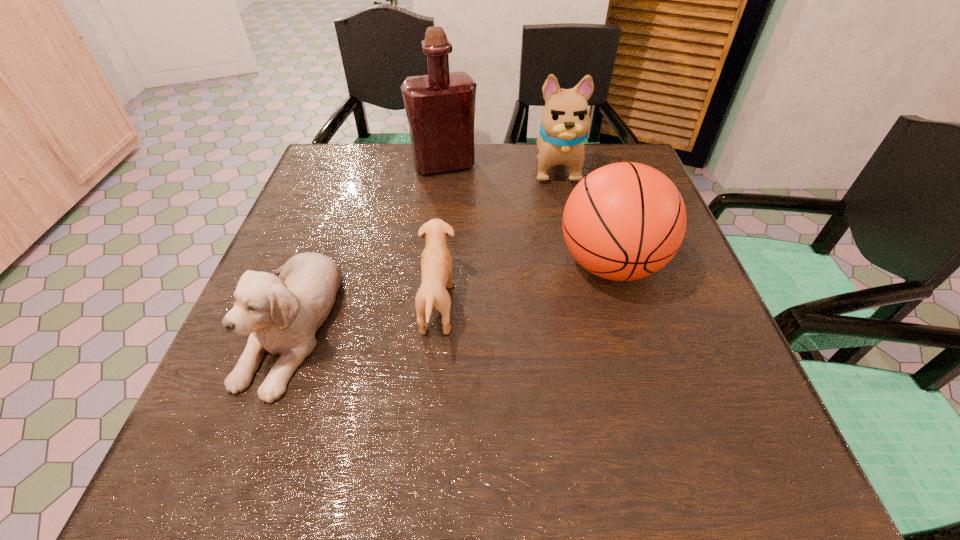
At what (x,y) coordinates should I click in order to perform the action: click on blank space at the far left corner. Please return your answer as a coordinate pair (x, y). This screenshot has width=960, height=540. Looking at the image, I should click on (317, 165).

The image size is (960, 540). What are the coordinates of `vacant region at the near left corner of the desktop` in the screenshot? It's located at (294, 440).

The width and height of the screenshot is (960, 540). In the image, there is a desktop. What are the coordinates of `vacant space at the far right corner` in the screenshot? It's located at (636, 160).

Locate an element on the screen. unoccupied area between the second puppy from right to left and the rightmost puppy is located at coordinates (496, 236).

At what (x,y) coordinates should I click in order to perform the action: click on unoccupied position between the farthest puppy and the tallest object. Please return your answer as a coordinate pair (x, y). Looking at the image, I should click on (500, 165).

The width and height of the screenshot is (960, 540). Identify the location of free spot between the basketball and the liquor. (527, 214).

Image resolution: width=960 pixels, height=540 pixels. Find the location of `vacant region between the shortest object and the second shortest puppy`. vacant region between the shortest object and the second shortest puppy is located at coordinates (x=363, y=314).

Image resolution: width=960 pixels, height=540 pixels. I want to click on free spot between the farthest puppy and the second tallest puppy, so click(x=422, y=245).

Identify the location of free space between the farthest puppy and the shortest puppy. The width and height of the screenshot is (960, 540). (496, 236).

Image resolution: width=960 pixels, height=540 pixels. I want to click on object that is the closest one to the basketball, so click(565, 118).